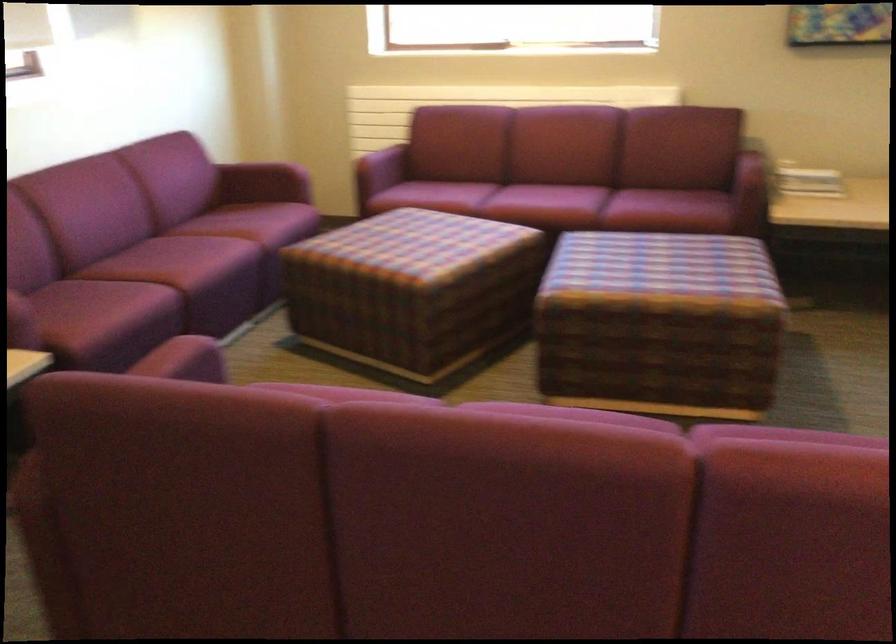
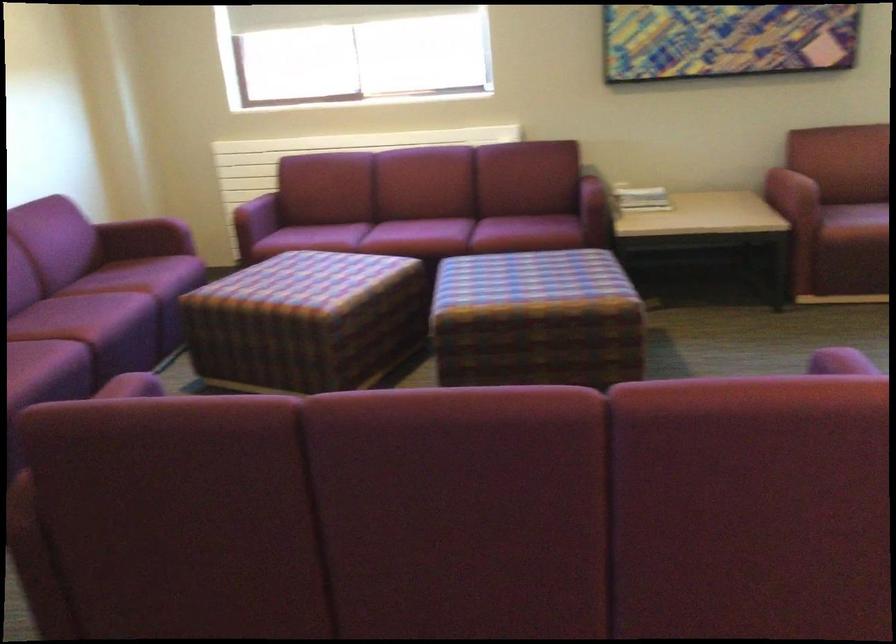
Where in the second image is the point corresponding to [366,147] from the first image?

(242, 198)